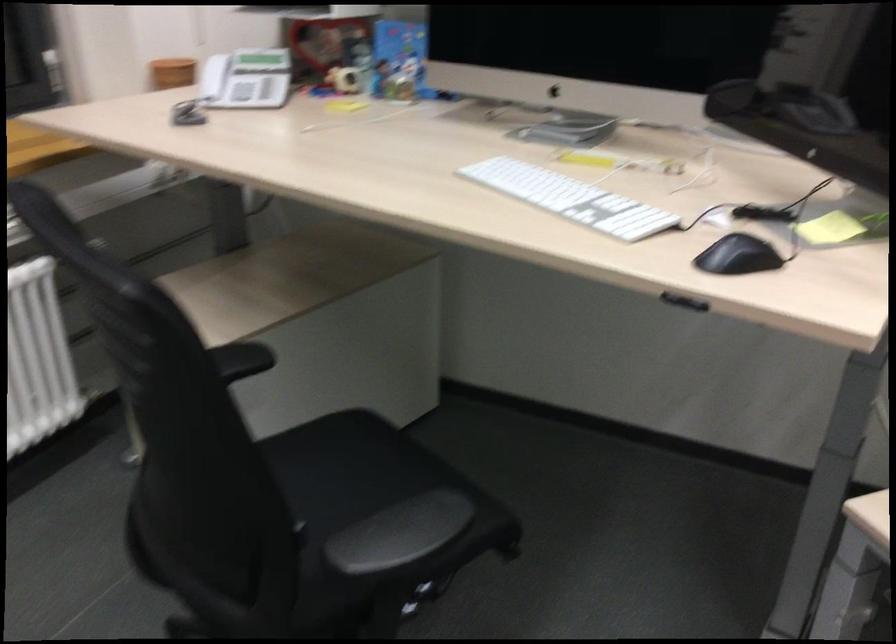
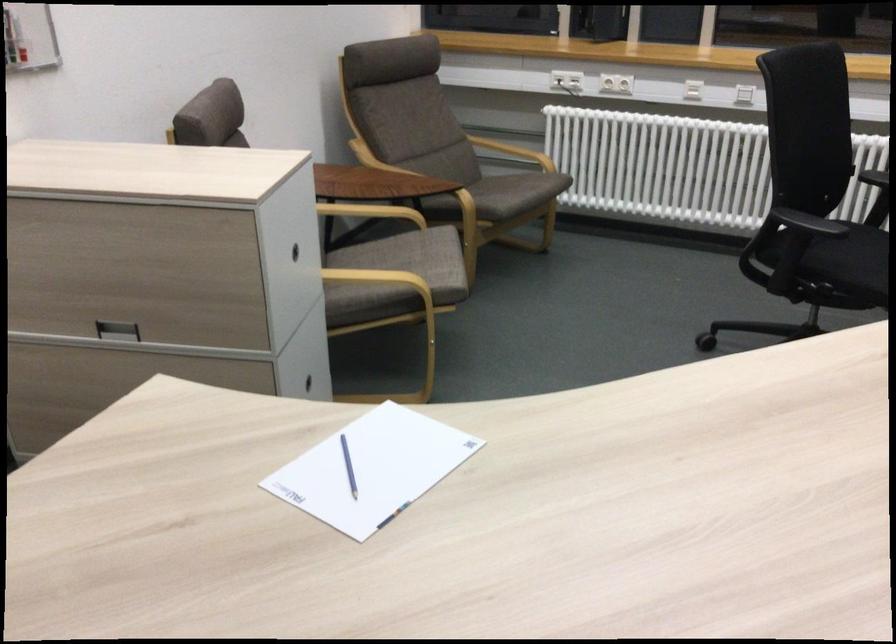
The point at [403,534] is marked in the first image. Where is the corresponding point in the second image?

(807, 223)